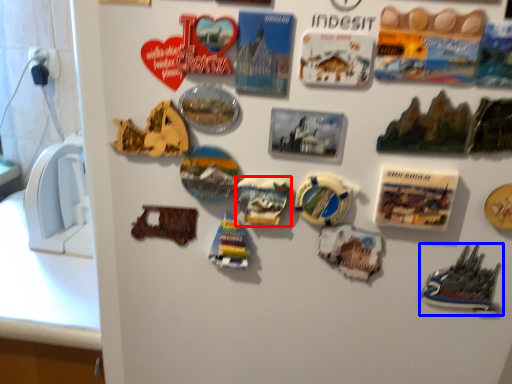
Question: Which object appears closest to the camera in this image, stuff (highlighted by a red box) or toy (highlighted by a blue box)?

Choices:
 (A) stuff
 (B) toy

Answer: (B)